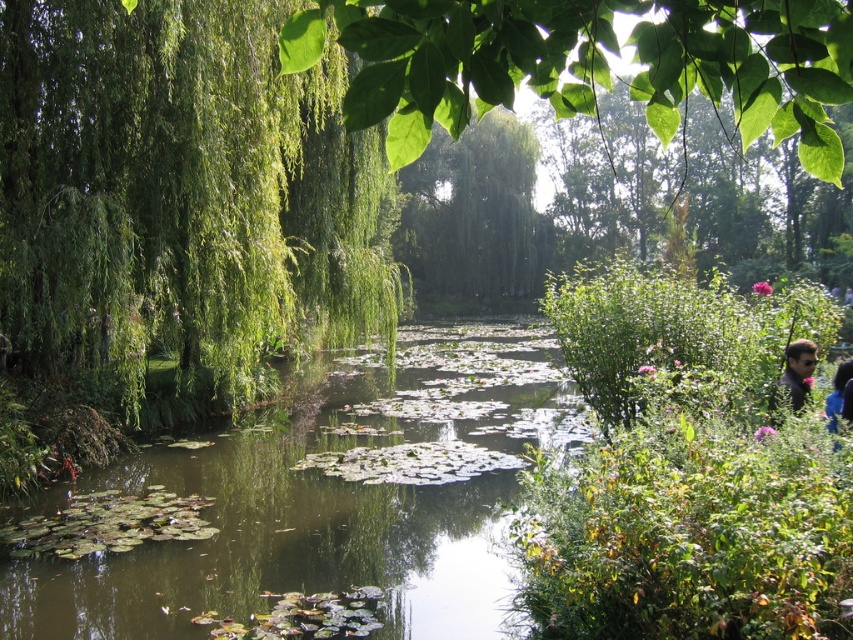
Is point (164, 492) closer to viewer compared to point (814, 356)?

No, (164, 492) is behind (814, 356).

Is green leafy river at center shorter than dark gray shirt at lower right?

No, green leafy river at center is not shorter than dark gray shirt at lower right.

Between point (386, 531) and point (801, 365), which one is positioned behind?

Point (386, 531)

Identify the location of green leafy river at center. (312, 500).

This screenshot has height=640, width=853. Describe the element at coordinates (181, 196) in the screenshot. I see `green leafy willow at left` at that location.

Which of these two, green leafy willow at left or green leafy willow at center, stands shorter?

green leafy willow at left

Find the location of a particular element. This screenshot has height=640, width=853. green leafy willow at left is located at coordinates pyautogui.click(x=181, y=196).

Based on the photo, does green leafy river at center have a lesser width compared to green leafy willow at center?

Indeed, green leafy river at center has a lesser width compared to green leafy willow at center.

Who is taller, green leafy river at center or green leafy willow at center?

Standing taller between the two is green leafy willow at center.

Describe the element at coordinates (312, 500) in the screenshot. I see `green leafy river at center` at that location.

You are a GUI agent. You are given a task and a screenshot of the screen. Output one action in this format:
    pyautogui.click(x=<x>, y=<y>)
    Task: Click on the green leafy river at center
    
    Given the screenshot: What is the action you would take?
    pyautogui.click(x=312, y=500)